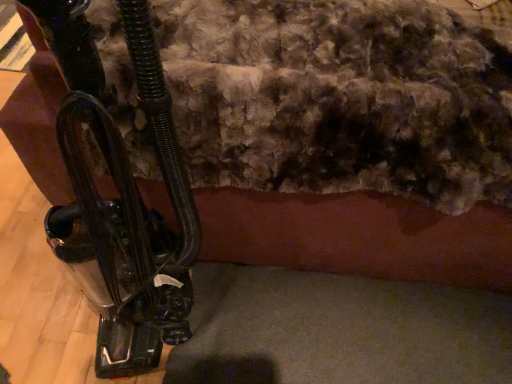
Question: Does metallic black vacuum cleaner at left turn towards fuzzy wool at upper center?

Choices:
 (A) yes
 (B) no

Answer: (B)

Question: Is metallic black vacuum cleaner at left at the right side of fuzzy wool at upper center?

Choices:
 (A) no
 (B) yes

Answer: (A)

Question: Is metallic black vacuum cleaner at left oriented away from fuzzy wool at upper center?

Choices:
 (A) yes
 (B) no

Answer: (A)

Question: Is fuzzy wool at upper center inside metallic black vacuum cleaner at left?

Choices:
 (A) yes
 (B) no

Answer: (B)

Question: From a real-world perspective, is metallic black vacuum cleaner at left located higher than fuzzy wool at upper center?

Choices:
 (A) no
 (B) yes

Answer: (B)

Question: Is metallic black vacuum cleaner at left thinner than fuzzy wool at upper center?

Choices:
 (A) no
 (B) yes

Answer: (B)

Question: Is fuzzy wool at upper center surrounding metallic black vacuum cleaner at left?

Choices:
 (A) yes
 (B) no

Answer: (B)

Question: From a real-world perspective, is fuzzy wool at upper center on top of metallic black vacuum cleaner at left?

Choices:
 (A) no
 (B) yes

Answer: (A)

Question: Considering the relative sizes of fuzzy wool at upper center and metallic black vacuum cleaner at left in the image provided, is fuzzy wool at upper center shorter than metallic black vacuum cleaner at left?

Choices:
 (A) yes
 (B) no

Answer: (A)

Question: Considering the relative positions of fuzzy wool at upper center and metallic black vacuum cleaner at left in the image provided, is fuzzy wool at upper center to the left of metallic black vacuum cleaner at left from the viewer's perspective?

Choices:
 (A) no
 (B) yes

Answer: (A)

Question: Is fuzzy wool at upper center taller than metallic black vacuum cleaner at left?

Choices:
 (A) no
 (B) yes

Answer: (A)

Question: Considering the relative positions of fuzzy wool at upper center and metallic black vacuum cleaner at left in the image provided, is fuzzy wool at upper center behind metallic black vacuum cleaner at left?

Choices:
 (A) no
 (B) yes

Answer: (B)

Question: Looking at their shapes, would you say fuzzy wool at upper center is wider or thinner than metallic black vacuum cleaner at left?

Choices:
 (A) thin
 (B) wide

Answer: (B)